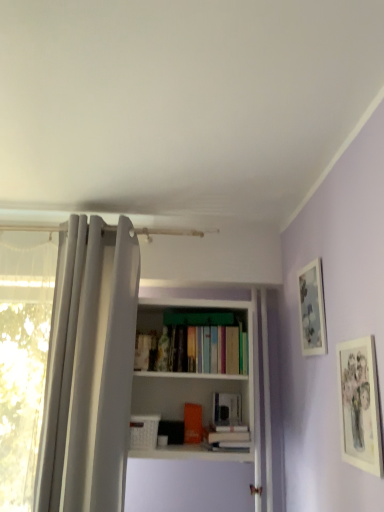
Question: Which direction should I rotate to look at hardcover book at center, marked as the 2th book in a left-to-right arrangement, — up or down?

Choices:
 (A) down
 (B) up

Answer: (A)

Question: Which direction should I rotate to face orange matte bookshelf at center, the 2th book positioned from the right, — up or down?

Choices:
 (A) down
 (B) up

Answer: (A)

Question: Is white fabric shower curtain at left completely or partially outside of matte paper picture frame at right, which is counted as the second picture frame, starting from the back?

Choices:
 (A) yes
 (B) no

Answer: (A)

Question: Does white fabric shower curtain at left turn towards matte paper picture frame at right, which is counted as the second picture frame, starting from the back?

Choices:
 (A) yes
 (B) no

Answer: (B)

Question: Is matte paper picture frame at right, the first picture frame viewed from the front, at the back of white fabric shower curtain at left?

Choices:
 (A) no
 (B) yes

Answer: (A)

Question: Can you confirm if white fabric shower curtain at left is taller than matte paper picture frame at right, which is counted as the second picture frame, starting from the back?

Choices:
 (A) no
 (B) yes

Answer: (B)

Question: Is matte paper picture frame at right, the first picture frame viewed from the front, a part of white fabric shower curtain at left?

Choices:
 (A) yes
 (B) no

Answer: (B)

Question: From the image's perspective, is white fabric shower curtain at left on matte paper picture frame at right, the first picture frame viewed from the front?

Choices:
 (A) no
 (B) yes

Answer: (B)

Question: Is matte paper picture frame at right, the first picture frame viewed from the front, oriented away from orange matte bookshelf at center, which is counted as the 1th book, starting from the left?

Choices:
 (A) yes
 (B) no

Answer: (B)

Question: From a real-world perspective, is matte paper picture frame at right, which is counted as the second picture frame, starting from the back, physically below orange matte bookshelf at center, which is counted as the 1th book, starting from the left?

Choices:
 (A) no
 (B) yes

Answer: (A)

Question: Is matte paper picture frame at right, the first picture frame viewed from the front, not inside orange matte bookshelf at center, the 2th book positioned from the right?

Choices:
 (A) no
 (B) yes

Answer: (B)

Question: From the image's perspective, is matte paper picture frame at right, the first picture frame viewed from the front, located beneath orange matte bookshelf at center, which is counted as the 1th book, starting from the left?

Choices:
 (A) no
 (B) yes

Answer: (A)

Question: From a real-world perspective, is matte paper picture frame at right, which is counted as the second picture frame, starting from the back, over orange matte bookshelf at center, the 2th book positioned from the right?

Choices:
 (A) yes
 (B) no

Answer: (A)

Question: Would you say matte paper picture frame at right, which is counted as the second picture frame, starting from the back, contains orange matte bookshelf at center, which is counted as the 1th book, starting from the left?

Choices:
 (A) no
 (B) yes

Answer: (A)

Question: Is hardcover book at center, marked as the 2th book in a left-to-right arrangement, taller than matte silver picture frame at upper right, which is the first picture frame from back to front?

Choices:
 (A) yes
 (B) no

Answer: (B)